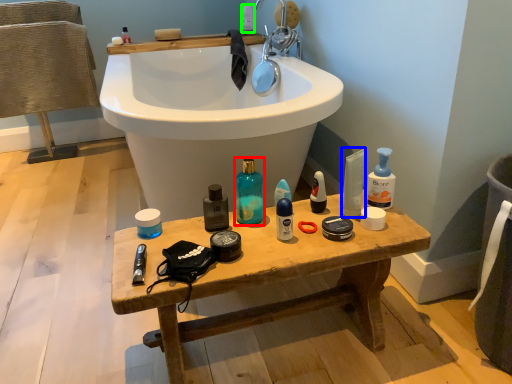
Question: Estimate the real-world distances between objects in this image. Which object is farther from cleaning product (highlighted by a red box), cleaning product (highlighted by a blue box) or toiletry (highlighted by a green box)?

Choices:
 (A) cleaning product
 (B) toiletry

Answer: (B)